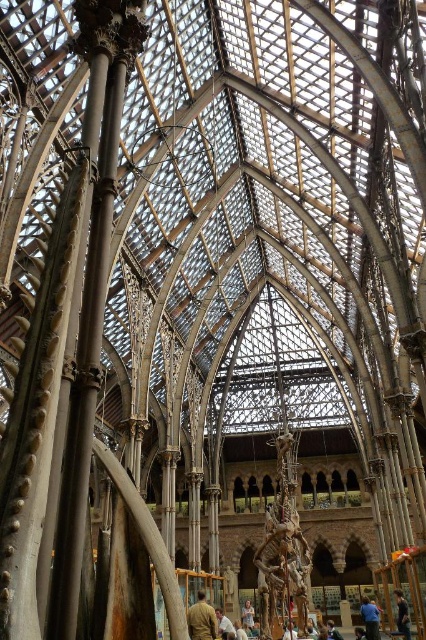
You are a visitor in the hall and want to sit down. You see the dark blue jeans at lower right and the light brown wooden chair at center. Which one is shorter and thus more suitable for sitting?

The dark blue jeans at lower right is shorter than the light brown wooden chair at center, so it is more suitable for sitting.

You are a security guard in the hall and need to place a 1.2 meter wide barrier between the light brown leather jacket at lower center and the blue fabric shirt at lower right. Can the barrier fit between them?

The light brown leather jacket at lower center has a lesser width compared to blue fabric shirt at lower right. The total width of both objects combined is not provided, so it is impossible to determine if the barrier will fit. However, since the jacket is narrower than the shirt, the space between them might be sufficient. Further measurements are needed for an accurate assessment.